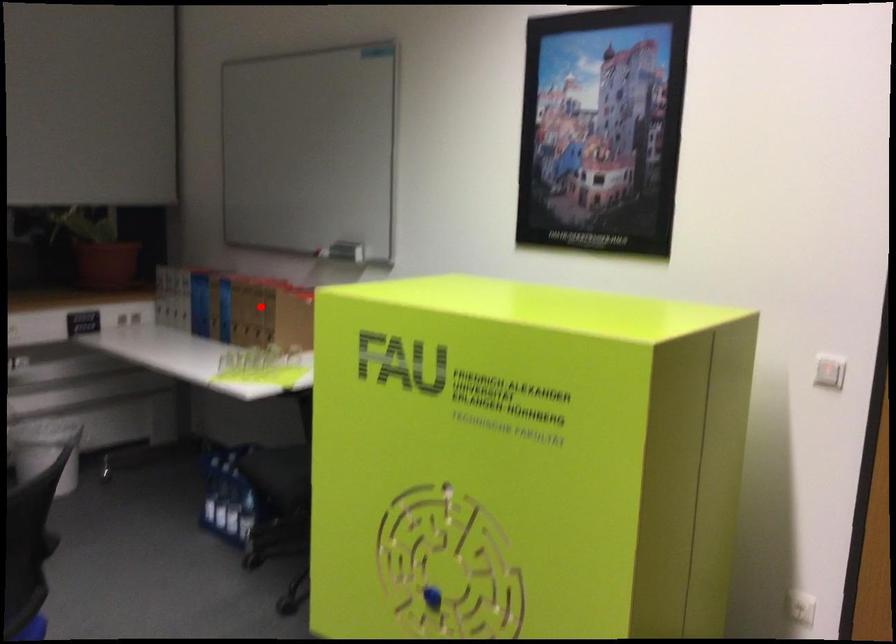
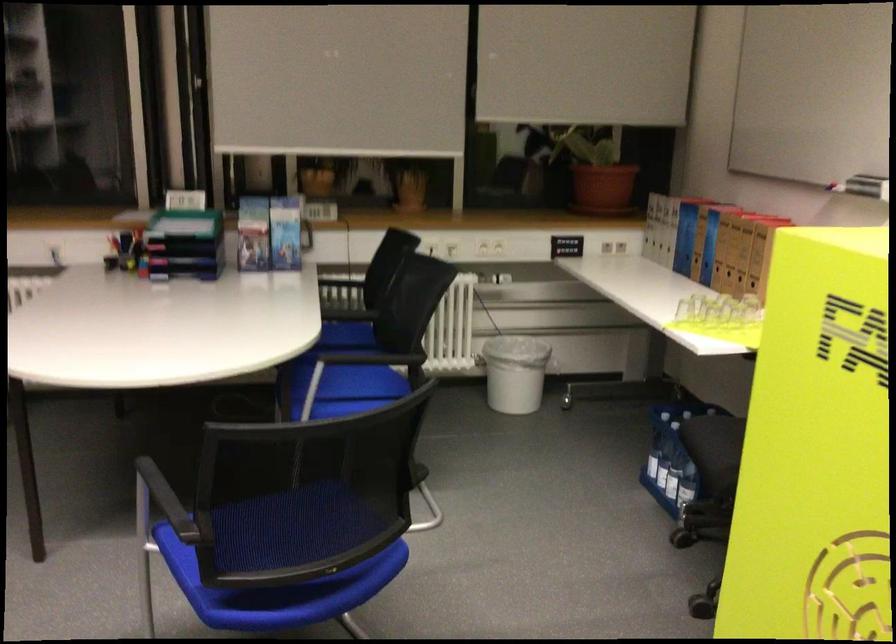
The point at the highlighted location is marked in the first image. Where is the corresponding point in the second image?

(746, 243)